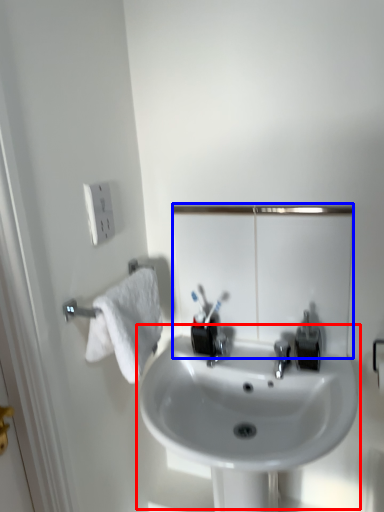
Question: Which of the following is the farthest to the observer, sink (highlighted by a red box) or mirror (highlighted by a blue box)?

Choices:
 (A) sink
 (B) mirror

Answer: (B)